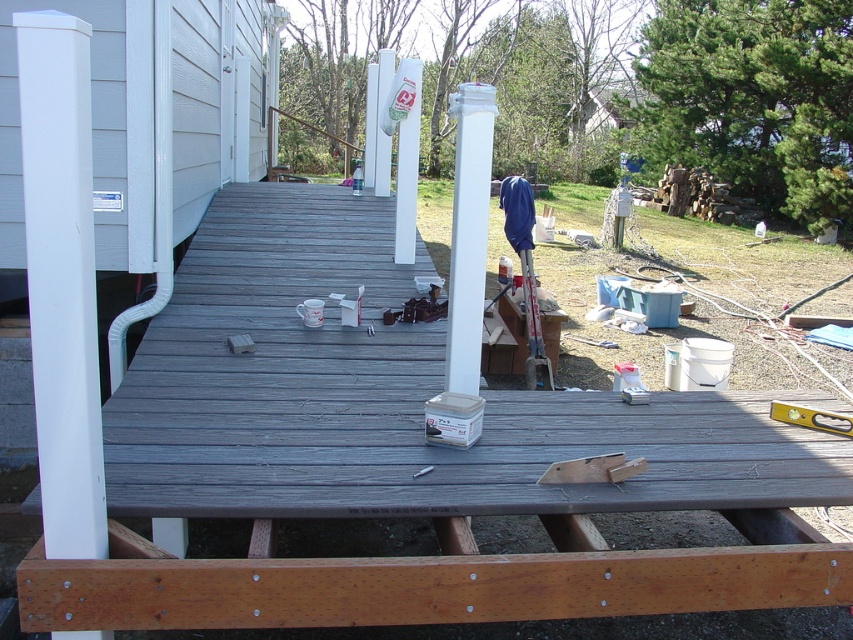
Question: Can you confirm if white painted wood post at left is positioned to the right of white glossy post at center?

Choices:
 (A) yes
 (B) no

Answer: (B)

Question: Among these points, which one is nearest to the camera?

Choices:
 (A) (65, 358)
 (B) (494, 106)

Answer: (A)

Question: Can you confirm if white painted wood post at left is positioned below white glossy post at center?

Choices:
 (A) no
 (B) yes

Answer: (B)

Question: Which point is farther from the camera taking this photo?

Choices:
 (A) (454, 305)
 (B) (20, 58)

Answer: (A)

Question: Does white painted wood post at left have a greater width compared to white glossy post at center?

Choices:
 (A) no
 (B) yes

Answer: (B)